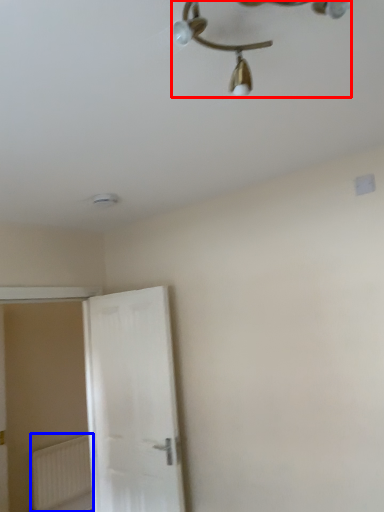
Question: Among these objects, which one is farthest to the camera, lamp (highlighted by a red box) or radiator (highlighted by a blue box)?

Choices:
 (A) lamp
 (B) radiator

Answer: (B)